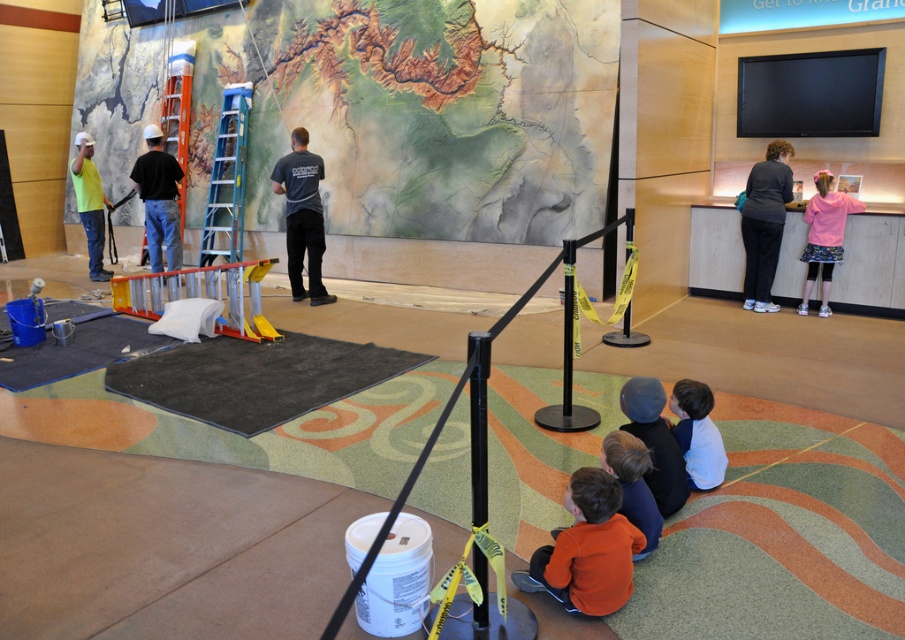
You are a safety officer in the room and need to ensure that all workers are within a 5 meter safety zone. Are the dark gray shirt at center and pink fleece jacket at upper right within the 5 meter safety zone?

The distance between the dark gray shirt at center and pink fleece jacket at upper right is 4.73 meters, which is within the 5 meter safety zone. Therefore, both workers are within the required distance.

Based on the scene description, where exactly is the matte black shirt at center located in terms of coordinates?

The matte black shirt at center is located at coordinates point (159, 198).

You are a visitor in the room where the map mural is being installed. You see a dark gray shirt at center and a pink fleece jacket at upper right. Which one is more to the left?

The dark gray shirt at center is more to the left because it is positioned on the left side of the pink fleece jacket at upper right.